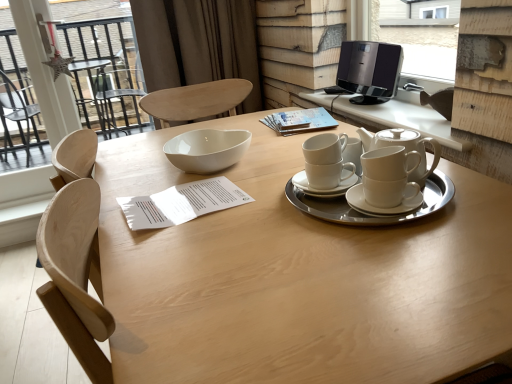
Question: Is transparent glass door at upper left oriented towards white ceramic teapot at upper right?

Choices:
 (A) no
 (B) yes

Answer: (B)

Question: Can you confirm if transparent glass door at upper left is positioned to the right of white ceramic teapot at upper right?

Choices:
 (A) yes
 (B) no

Answer: (B)

Question: Can you confirm if transparent glass door at upper left is positioned to the left of white ceramic teapot at upper right?

Choices:
 (A) no
 (B) yes

Answer: (B)

Question: Is transparent glass door at upper left not close to white ceramic teapot at upper right?

Choices:
 (A) yes
 (B) no

Answer: (A)

Question: Considering the relative sizes of transparent glass door at upper left and white ceramic teapot at upper right in the image provided, is transparent glass door at upper left thinner than white ceramic teapot at upper right?

Choices:
 (A) no
 (B) yes

Answer: (B)

Question: From the image's perspective, is transparent glass door at upper left beneath white ceramic teapot at upper right?

Choices:
 (A) no
 (B) yes

Answer: (A)

Question: Is white ceramic cups at center closer to camera compared to black plastic speaker at upper right?

Choices:
 (A) yes
 (B) no

Answer: (A)

Question: Is white ceramic cups at center oriented towards black plastic speaker at upper right?

Choices:
 (A) yes
 (B) no

Answer: (B)

Question: Is black plastic speaker at upper right inside white ceramic cups at center?

Choices:
 (A) no
 (B) yes

Answer: (A)

Question: Is white ceramic cups at center smaller than black plastic speaker at upper right?

Choices:
 (A) no
 (B) yes

Answer: (B)

Question: Is white ceramic cups at center taller than black plastic speaker at upper right?

Choices:
 (A) no
 (B) yes

Answer: (A)

Question: Is white ceramic cups at center bigger than black plastic speaker at upper right?

Choices:
 (A) yes
 (B) no

Answer: (B)

Question: Is white ceramic cups at center smaller than black glossy speaker at upper right?

Choices:
 (A) yes
 (B) no

Answer: (A)